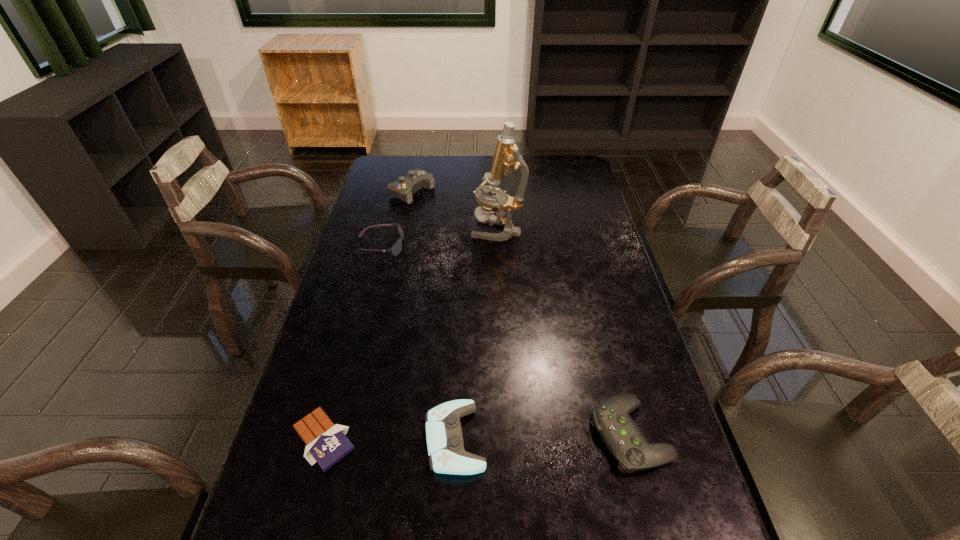
Where is `free point between the chocolate bar and the sunglasses`? Image resolution: width=960 pixels, height=540 pixels. free point between the chocolate bar and the sunglasses is located at coordinates (351, 343).

At what (x,y) coordinates should I click in order to perform the action: click on free space that is in between the rightmost object and the microscope. Please return your answer as a coordinate pair (x, y). This screenshot has width=960, height=540. Looking at the image, I should click on (564, 332).

Identify the location of object that is the fifth closest to the second control from left to right. (404, 188).

Identify which object is the nearest to the leftmost control. Please provide its 2D coordinates. Your answer should be formatted as a tuple, i.e. [(x, y)], where the tuple contains the x and y coordinates of a point satisfying the conditions above.

[(506, 159)]

Where is `control that is the second closest to the sunglasses`? The image size is (960, 540). control that is the second closest to the sunglasses is located at coordinates (447, 455).

Locate which control is the closest to the second tallest object. Please provide its 2D coordinates. Your answer should be formatted as a tuple, i.e. [(x, y)], where the tuple contains the x and y coordinates of a point satisfying the conditions above.

[(447, 455)]

This screenshot has width=960, height=540. I want to click on free point that satisfies the following two spatial constraints: 1. on the lenses of the second control from left to right; 2. on the left side of the sunglasses, so click(329, 439).

Locate an element on the screen. vacant area that satisfies the following two spatial constraints: 1. on the lenses of the sunglasses; 2. on the right side of the rightmost control is located at coordinates (330, 435).

The height and width of the screenshot is (540, 960). Find the location of `free space that satisfies the following two spatial constraints: 1. on the lenses of the sunglasses; 2. on the back side of the second control from right to left`. free space that satisfies the following two spatial constraints: 1. on the lenses of the sunglasses; 2. on the back side of the second control from right to left is located at coordinates (329, 439).

At what (x,y) coordinates should I click in order to perform the action: click on vacant area in the image that satisfies the following two spatial constraints: 1. on the back side of the second control from left to right; 2. on the left side of the chocolate bar. Please return your answer as a coordinate pair (x, y). The height and width of the screenshot is (540, 960). Looking at the image, I should click on (324, 439).